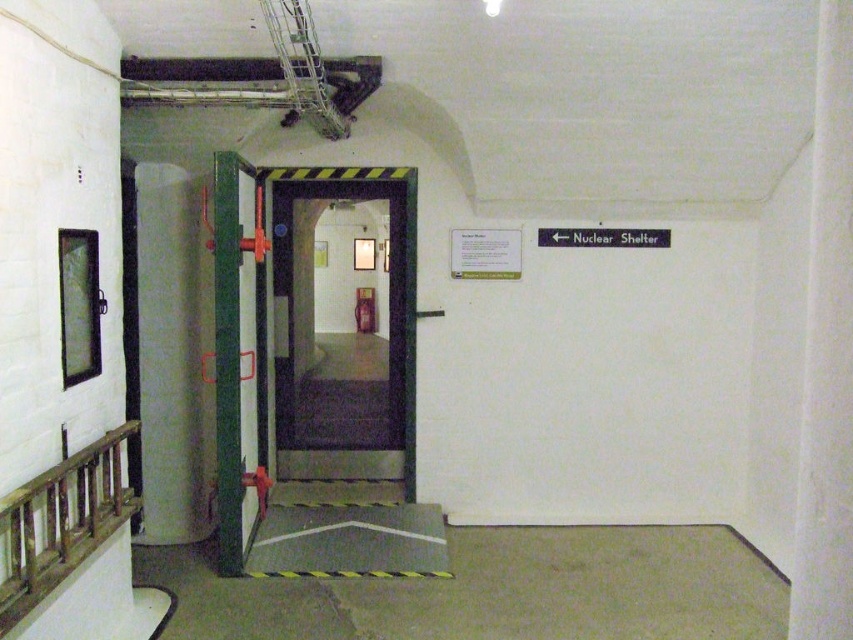
Question: Is green matte door at center positioned behind metallic door at center?

Choices:
 (A) no
 (B) yes

Answer: (A)

Question: Does wooden at left have a larger size compared to metallic door at center?

Choices:
 (A) no
 (B) yes

Answer: (A)

Question: Which point is closer to the camera?

Choices:
 (A) green matte door at center
 (B) wooden at left

Answer: (B)

Question: Is green matte door at center to the left of wooden at left from the viewer's perspective?

Choices:
 (A) yes
 (B) no

Answer: (B)

Question: Estimate the real-world distances between objects in this image. Which object is farther from the green matte door at center?

Choices:
 (A) wooden at left
 (B) metallic door at center

Answer: (A)

Question: Which object appears closest to the camera in this image?

Choices:
 (A) metallic door at center
 (B) green matte door at center
 (C) wooden at left

Answer: (C)